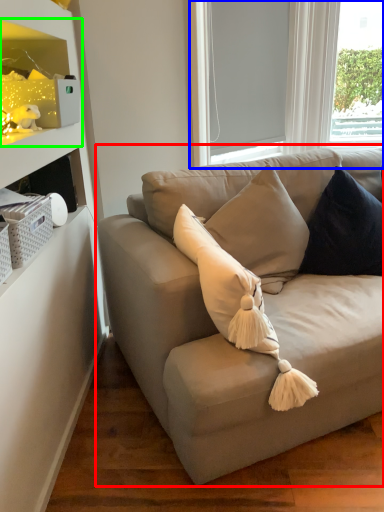
Question: Which object is positioned farthest from studio couch (highlighted by a red box)? Select from bay window (highlighted by a blue box) and shelf (highlighted by a green box).

Choices:
 (A) bay window
 (B) shelf

Answer: (A)